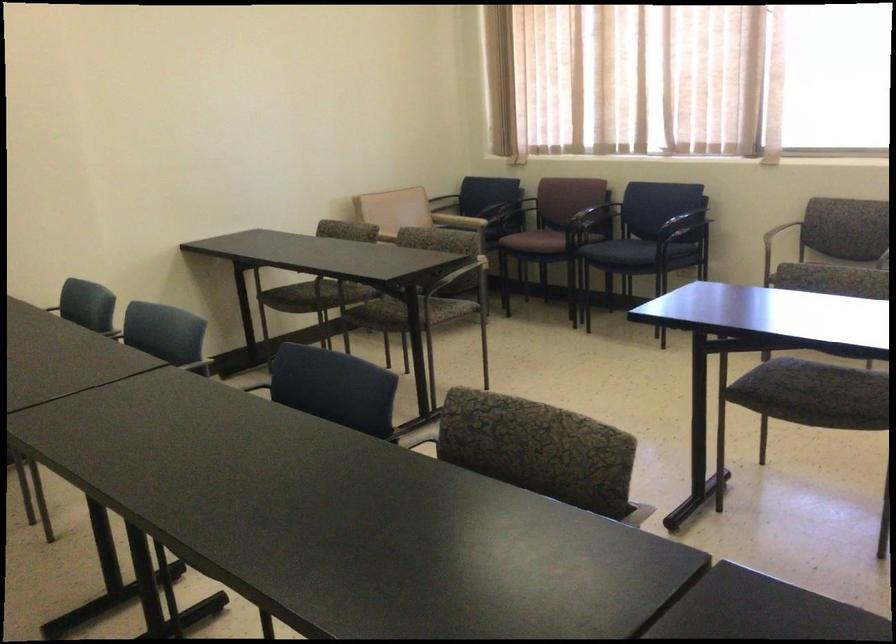
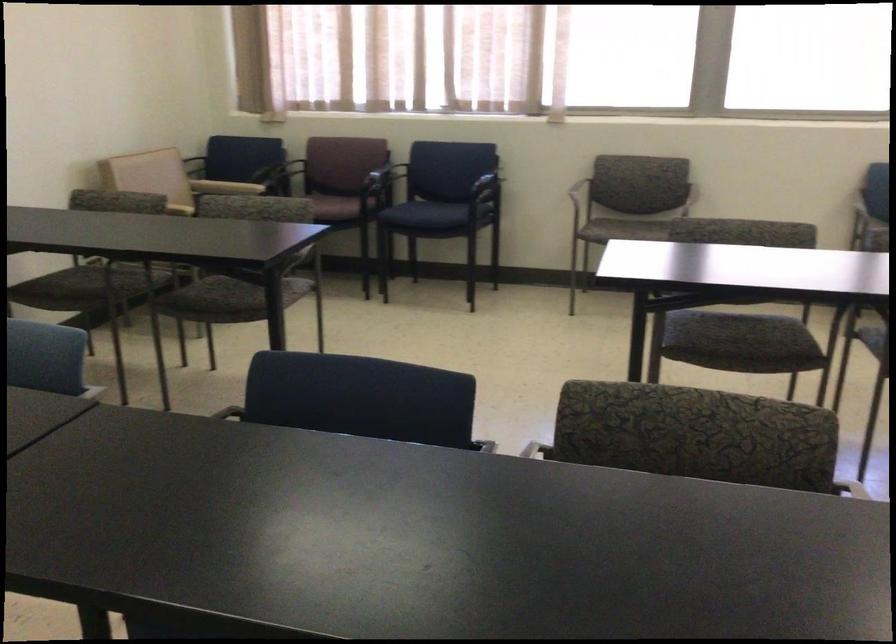
Question: Based on the continuous images, in which direction is the camera rotating? Reply with the corresponding letter.

Choices:
 (A) Left
 (B) Right
 (C) Up
 (D) Down

Answer: (B)